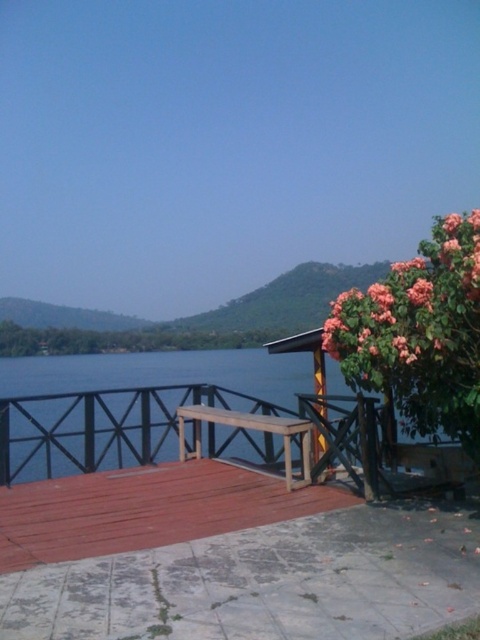
Can you confirm if pink matte flower at upper right is shorter than wooden picnic table at center?

No, pink matte flower at upper right is not shorter than wooden picnic table at center.

Is point (372, 333) farther from camera compared to point (307, 445)?

No, it is not.

Find the location of a particular element. The height and width of the screenshot is (640, 480). pink matte flower at upper right is located at coordinates (415, 316).